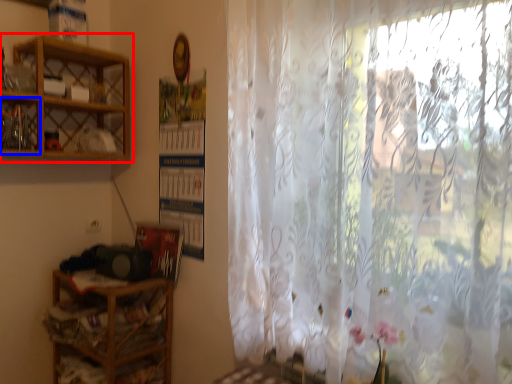
Question: Which of the following is the closest to the observer, shelf (highlighted by a red box) or cabinet (highlighted by a blue box)?

Choices:
 (A) shelf
 (B) cabinet

Answer: (A)